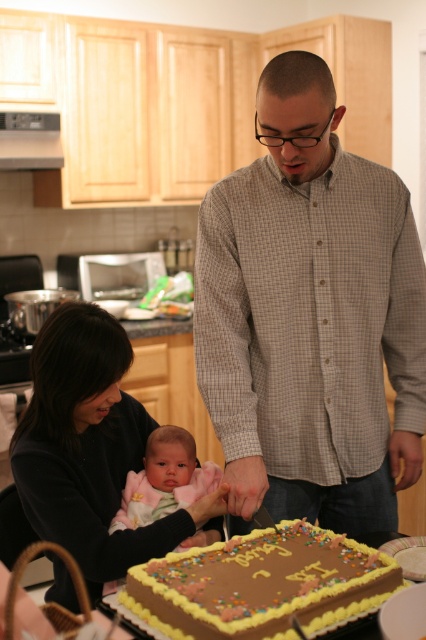
Is checkered shirt at center above matte black sweater at lower left?

Yes, checkered shirt at center is above matte black sweater at lower left.

Which is in front, point (284, 316) or point (68, 355)?

Point (68, 355)

Which is behind, point (373, 401) or point (34, 468)?

The point (373, 401) is behind.

You are a GUI agent. You are given a task and a screenshot of the screen. Output one action in this format:
    pyautogui.click(x=<x>, y=<y>)
    Task: Click on the checkered shirt at center
    
    Given the screenshot: What is the action you would take?
    pyautogui.click(x=310, y=317)

What do you see at coordinates (89, 448) in the screenshot? The width and height of the screenshot is (426, 640). I see `matte black sweater at lower left` at bounding box center [89, 448].

Is point (120, 468) positioned behind point (126, 524)?

Yes, point (120, 468) is farther from viewer.

Locate an element on the screen. The width and height of the screenshot is (426, 640). matte black sweater at lower left is located at coordinates (89, 448).

Is matte black sweater at lower left thinner than chocolate frosted cake at center?

Incorrect, matte black sweater at lower left's width is not less than chocolate frosted cake at center's.

Who is more distant from viewer, (210, 512) or (131, 595)?

Positioned behind is point (210, 512).

Locate an element on the screen. The image size is (426, 640). matte black sweater at lower left is located at coordinates (89, 448).

What are the coordinates of `matte black sweater at lower left` in the screenshot? It's located at (89, 448).